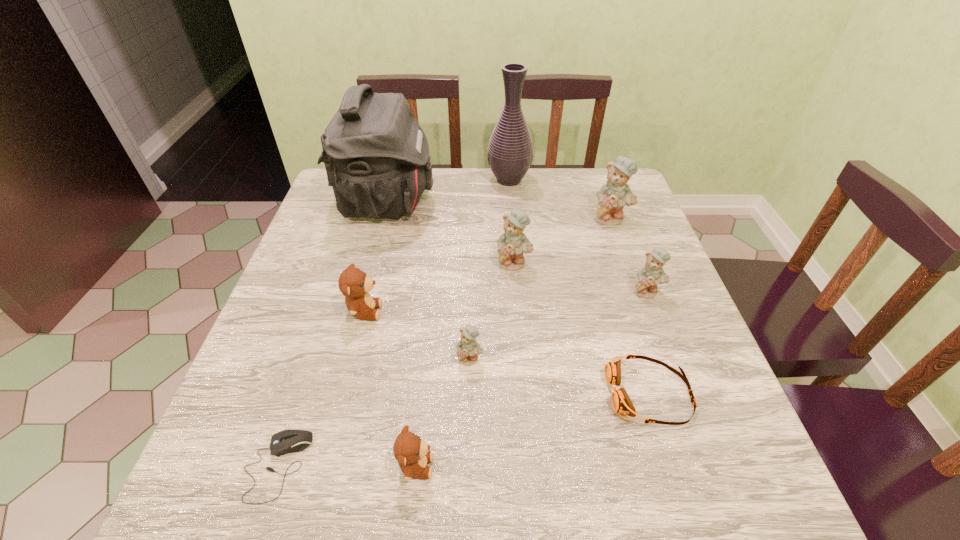
Locate an element on the screen. vacant region at the near edge of the desktop is located at coordinates (535, 501).

The width and height of the screenshot is (960, 540). What are the coordinates of `vacant space at the left edge` in the screenshot? It's located at (287, 362).

The width and height of the screenshot is (960, 540). In order to click on free space at the right edge of the desktop in this screenshot , I will do `click(610, 229)`.

The image size is (960, 540). What are the coordinates of `vacant area between the leftmost teddy bear and the nearer brown teddy bear` in the screenshot? It's located at coord(391,389).

You are a GUI agent. You are given a task and a screenshot of the screen. Output one action in this format:
    pyautogui.click(x=<x>, y=<y>)
    Task: Click on the empty space that is in between the left brown teddy bear and the shoulder bag
    
    Given the screenshot: What is the action you would take?
    pyautogui.click(x=375, y=256)

The width and height of the screenshot is (960, 540). I want to click on free area in between the computer mouse and the farthest blue teddy bear, so click(x=444, y=342).

Where is `vacant space that's between the ninth tallest object and the vase`? vacant space that's between the ninth tallest object and the vase is located at coordinates (579, 287).

The image size is (960, 540). What are the coordinates of `empty location between the sixth object from right to left and the farther brown teddy bear` in the screenshot? It's located at click(418, 335).

Locate an element on the screen. free space between the gray shoulder bag and the goggles is located at coordinates (518, 298).

Locate an element on the screen. The height and width of the screenshot is (540, 960). empty space between the vase and the shoulder bag is located at coordinates (447, 191).